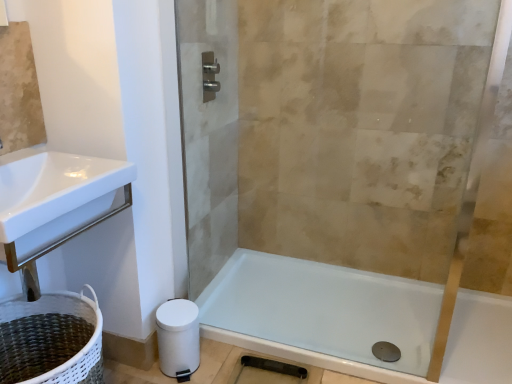
Locate an element on the screen. The width and height of the screenshot is (512, 384). vacant point to the right of clear glass shower door at center is located at coordinates (303, 309).